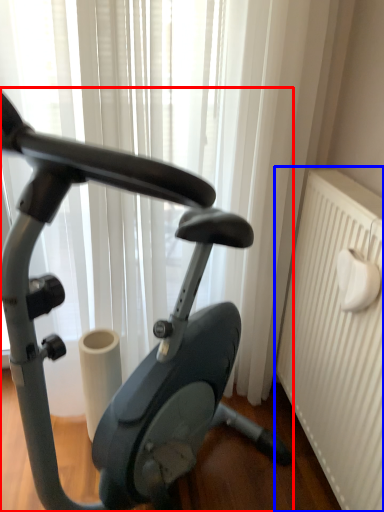
Question: Which object appears farthest to the camera in this image, stationary bicycle (highlighted by a red box) or radiator (highlighted by a blue box)?

Choices:
 (A) stationary bicycle
 (B) radiator

Answer: (B)